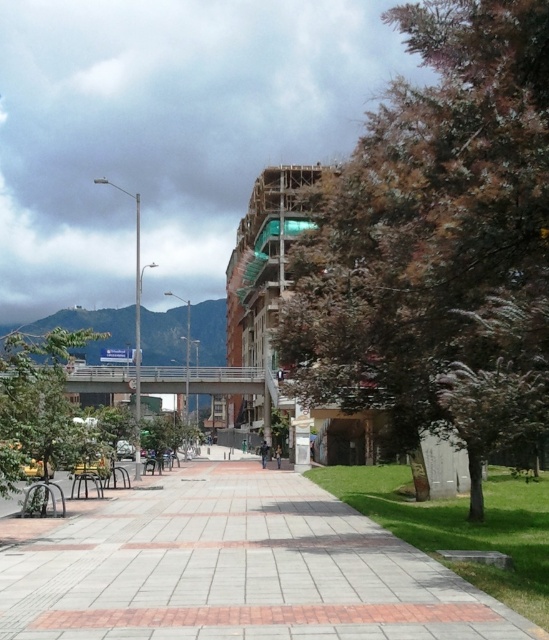
Does green leafy tree at lower left have a larger size compared to metallic park bench at lower left?

Correct, green leafy tree at lower left is larger in size than metallic park bench at lower left.

Based on the photo, does green leafy tree at lower left come in front of metallic park bench at lower left?

That is True.

Does point (16, 413) lie in front of point (75, 490)?

Yes, point (16, 413) is closer to viewer.

Identify the location of green leafy tree at lower left. This screenshot has height=640, width=549. (36, 401).

Can you confirm if brown textured tree at right is shorter than metallic park bench at lower left?

Incorrect, brown textured tree at right's height does not fall short of metallic park bench at lower left's.

In the scene shown: Does brown textured tree at right come behind metallic park bench at lower left?

No, it is in front of metallic park bench at lower left.

Is point (344, 349) behind point (82, 483)?

No, (344, 349) is closer to viewer.

Where is `brown textured tree at right`? The width and height of the screenshot is (549, 640). brown textured tree at right is located at coordinates (438, 241).

Measure the distance from brown textured tree at right to brick paved walkway at center.

brown textured tree at right and brick paved walkway at center are 6.30 meters apart from each other.

Does brown textured tree at right come behind brick paved walkway at center?

Yes, it is behind brick paved walkway at center.

Who is more distant from viewer, (531, 93) or (249, 548)?

The point (249, 548) is more distant.

Identify the location of brown textured tree at right. The height and width of the screenshot is (640, 549). (438, 241).